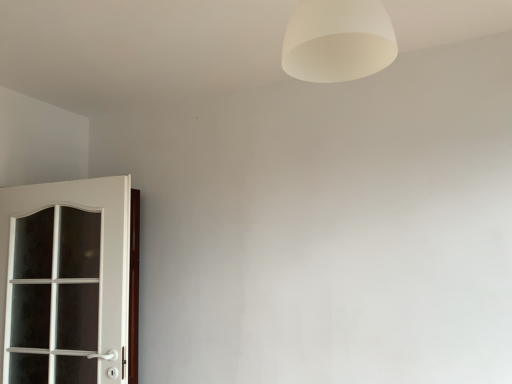
Locate an element on the screen. white glossy door at left is located at coordinates (66, 281).

What do you see at coordinates (66, 281) in the screenshot?
I see `white glossy door at left` at bounding box center [66, 281].

Locate an element on the screen. This screenshot has height=384, width=512. white glossy door at left is located at coordinates (66, 281).